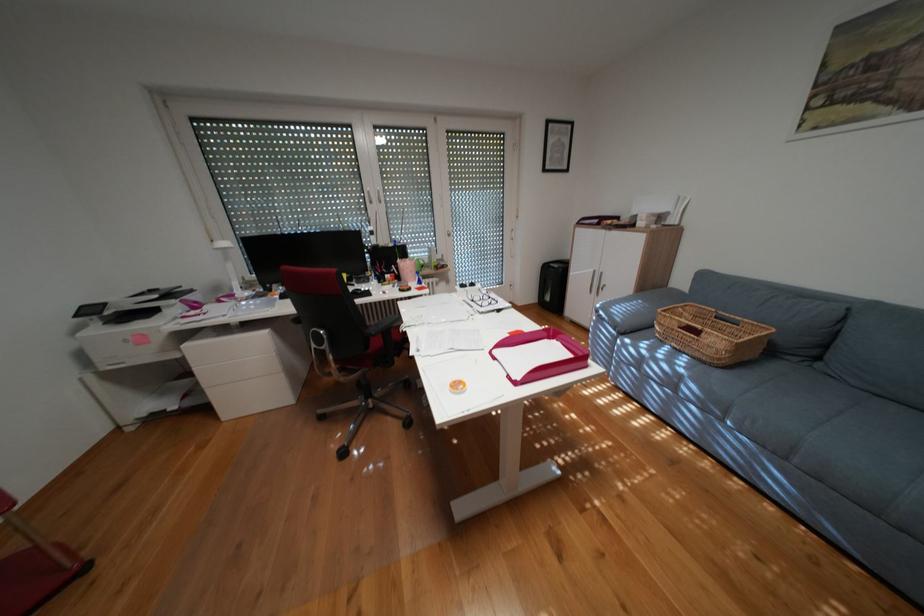
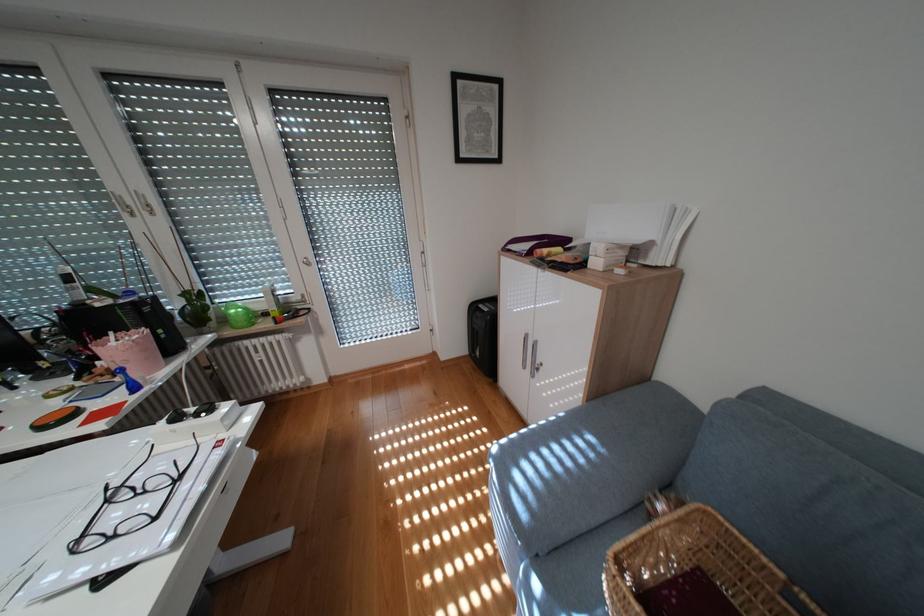
Find the pixel in the second image that matches point (484, 300) in the first image.

(119, 501)